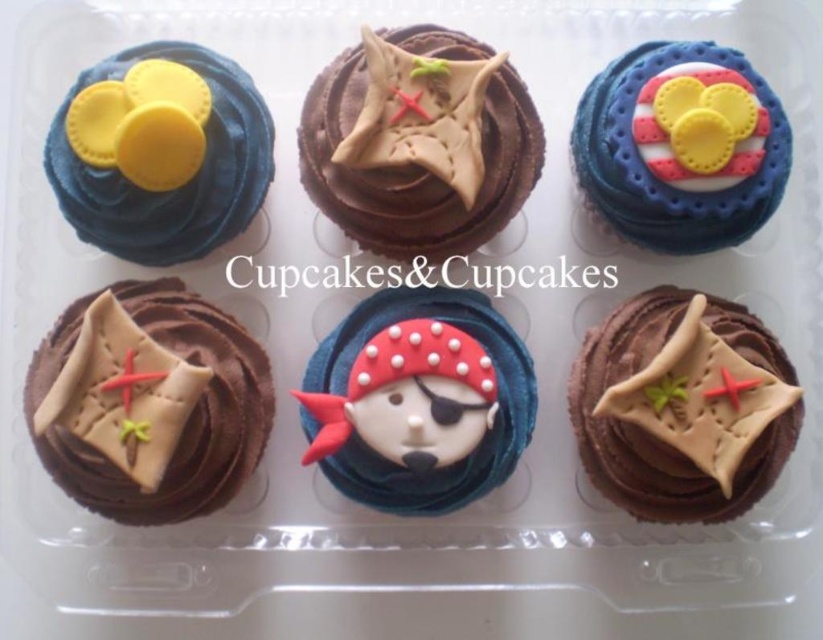
Question: Does chocolate matte pirate flag at center have a smaller size compared to matte blue frosting at upper left?

Choices:
 (A) no
 (B) yes

Answer: (B)

Question: Estimate the real-world distances between objects in this image. Which object is closer to the matte chocolate cupcake at center?

Choices:
 (A) matte blue fondant cupcake at upper right
 (B) chocolate matte paper at center
 (C) chocolate matte pirate flag at center right

Answer: (B)

Question: Which point is closer to the camera taking this photo?

Choices:
 (A) (242, 108)
 (B) (380, 468)
 (C) (424, 132)
 (D) (33, 396)

Answer: (D)

Question: Which point appears closest to the camera in this image?

Choices:
 (A) (323, 186)
 (B) (454, 433)

Answer: (B)

Question: Is matte chocolate cupcake at center thinner than matte blue fondant cupcake at upper right?

Choices:
 (A) yes
 (B) no

Answer: (B)

Question: Is chocolate matte pirate flag at center closer to the viewer compared to chocolate matte pirate flag at center right?

Choices:
 (A) yes
 (B) no

Answer: (B)